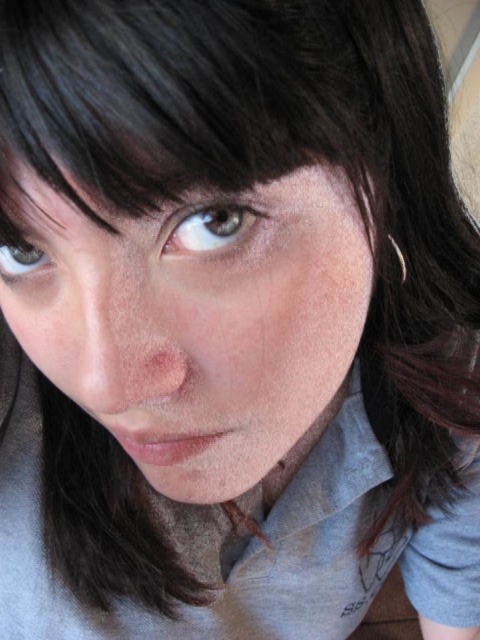
Which is above, brown matte eye at upper center or brown matte eye at upper left?

brown matte eye at upper center

The image size is (480, 640). Find the location of `brown matte eye at upper center`. brown matte eye at upper center is located at coordinates (212, 227).

Who is positioned more to the right, smooth skin face at center or brown matte eye at upper left?

smooth skin face at center is more to the right.

Who is higher up, smooth skin face at center or brown matte eye at upper left?

Positioned higher is brown matte eye at upper left.

Between point (289, 179) and point (19, 273), which one is positioned behind?

Positioned behind is point (19, 273).

The height and width of the screenshot is (640, 480). Find the location of `smooth skin face at center`. smooth skin face at center is located at coordinates (197, 321).

Is point (59, 316) closer to camera compared to point (196, 216)?

No, it is behind (196, 216).

Does smooth skin face at center appear under brown matte eye at upper center?

Yes, smooth skin face at center is below brown matte eye at upper center.

Locate an element on the screen. The height and width of the screenshot is (640, 480). smooth skin face at center is located at coordinates (197, 321).